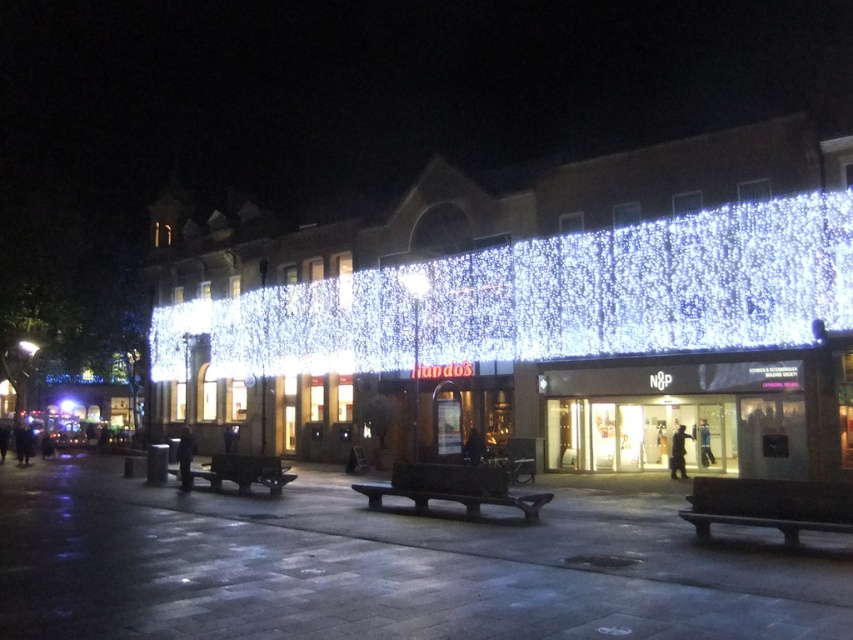
Question: In this image, where is illuminated glass facade at center located relative to black polished bench at lower right?

Choices:
 (A) above
 (B) below

Answer: (A)

Question: Estimate the real-world distances between objects in this image. Which object is closer to the black polished bench at lower right?

Choices:
 (A) wooden bench at center
 (B) smooth concrete benches at center
 (C) illuminated glass facade at center
 (D) dark brown wooden bench at center

Answer: (D)

Question: From the image, what is the correct spatial relationship of illuminated glass facade at center in relation to smooth concrete benches at center?

Choices:
 (A) right
 (B) left

Answer: (A)

Question: Estimate the real-world distances between objects in this image. Which object is closer to the wooden bench at center?

Choices:
 (A) illuminated glass facade at center
 (B) black polished bench at lower right
 (C) dark brown wooden bench at center
 (D) smooth concrete benches at center

Answer: (C)

Question: Can you confirm if black polished bench at lower right is positioned below wooden bench at center?

Choices:
 (A) no
 (B) yes

Answer: (A)

Question: Which point is farther to the camera?

Choices:
 (A) (415, 488)
 (B) (256, 468)

Answer: (B)